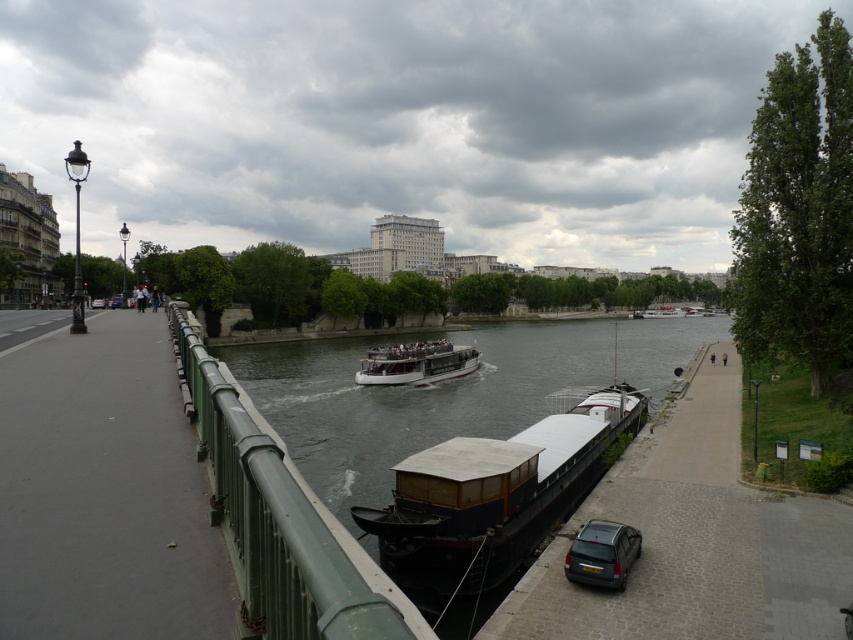
Is green metal railing at left thinner than white polished wood boat at center?

Yes, green metal railing at left is thinner than white polished wood boat at center.

Consider the image. Can you confirm if green metal railing at left is shorter than white polished wood boat at center?

No.

Who is more forward, (195, 417) or (410, 380)?

Positioned in front is point (195, 417).

At what (x,y) coordinates should I click in order to perform the action: click on green metal railing at left. Please return your answer as a coordinate pair (x, y). Image resolution: width=853 pixels, height=640 pixels. Looking at the image, I should click on (280, 520).

Is smooth dark water at center shorter than green metal railing at left?

No.

Is smooth dark water at center bigger than green metal railing at left?

Yes, smooth dark water at center is bigger than green metal railing at left.

Where is `smooth dark water at center`? smooth dark water at center is located at coordinates click(x=409, y=397).

Between dark brown wooden barge at center and metallic gray hatchback at lower right, which one is positioned higher?

dark brown wooden barge at center is higher up.

Which is in front, point (540, 465) or point (624, 554)?

Point (624, 554)

What do you see at coordinates (492, 497) in the screenshot? I see `dark brown wooden barge at center` at bounding box center [492, 497].

This screenshot has width=853, height=640. What are the coordinates of `dark brown wooden barge at center` in the screenshot? It's located at (492, 497).